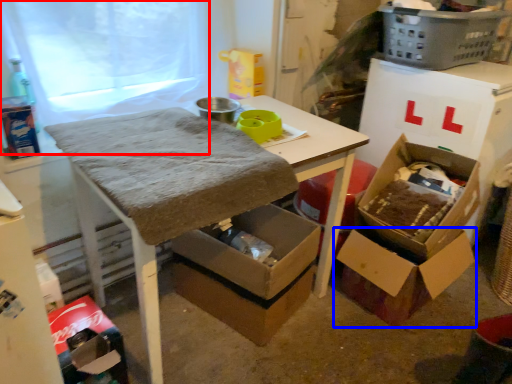
Question: Which of the following is the closest to the observer, window screen (highlighted by a red box) or box (highlighted by a blue box)?

Choices:
 (A) window screen
 (B) box

Answer: (A)